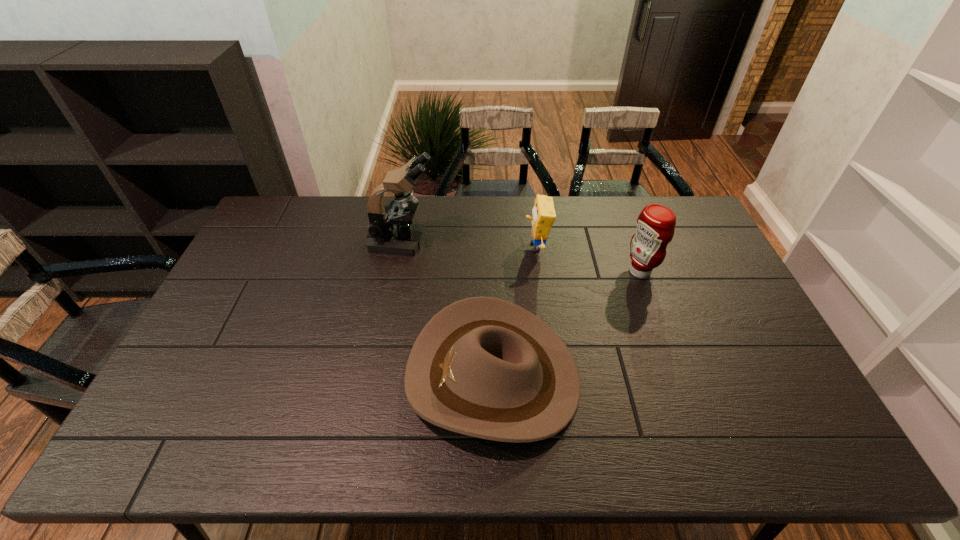
Identify the location of vacant space that satisfies the following two spatial constraints: 1. on the face of the sponge; 2. on the left side of the condiment. (540, 271).

The image size is (960, 540). I want to click on vacant space that satisfies the following two spatial constraints: 1. on the front side of the third shortest object; 2. on the right side of the microscope, so click(x=397, y=271).

At what (x,y) coordinates should I click in order to perform the action: click on vacant space that satisfies the following two spatial constraints: 1. on the face of the sponge; 2. on the right side of the rightmost object. Please return your answer as a coordinate pair (x, y). The image size is (960, 540). Looking at the image, I should click on (540, 271).

Locate an element on the screen. vacant space that satisfies the following two spatial constraints: 1. on the front side of the rightmost object; 2. with a star on the front of the cowboy hat is located at coordinates (679, 376).